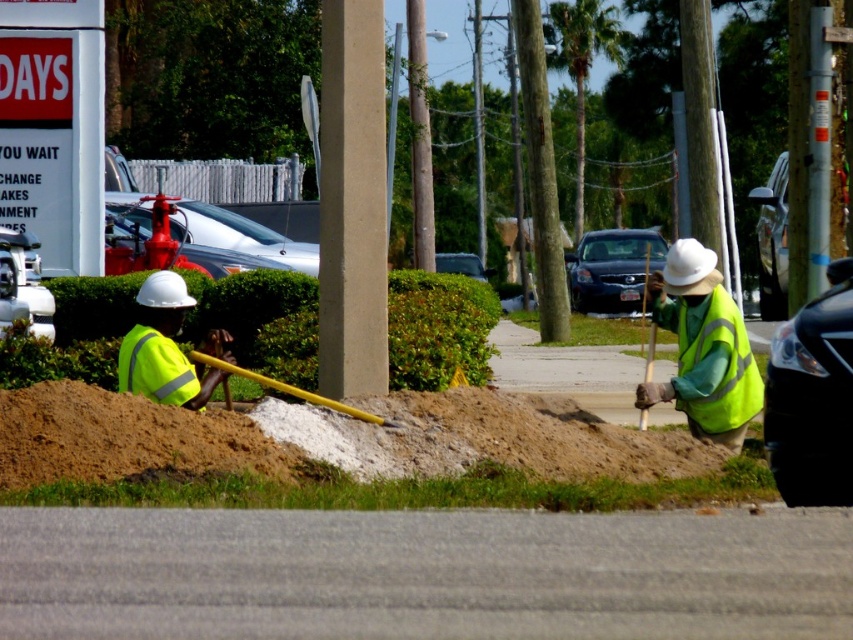
Between brown sandy dirt at center and green reflective safety vest at right, which one has more height?

Standing taller between the two is green reflective safety vest at right.

Where is `brown sandy dirt at center`? The height and width of the screenshot is (640, 853). brown sandy dirt at center is located at coordinates (483, 436).

Is high-visibility yellow safety vest at lower left smaller than yellow plastic shovel at lower center?

Correct, high-visibility yellow safety vest at lower left occupies less space than yellow plastic shovel at lower center.

Is high-visibility yellow safety vest at lower left thinner than yellow plastic shovel at lower center?

Yes, high-visibility yellow safety vest at lower left is thinner than yellow plastic shovel at lower center.

Where is `high-visibility yellow safety vest at lower left`? high-visibility yellow safety vest at lower left is located at coordinates (155, 368).

Does brown sandy dirt at lower left appear over high-visibility yellow vest at right?

No.

Based on the photo, does brown sandy dirt at lower left appear on the left side of high-visibility yellow vest at right?

Correct, you'll find brown sandy dirt at lower left to the left of high-visibility yellow vest at right.

In order to click on brown sandy dirt at lower left in this screenshot , I will do `click(125, 436)`.

Locate an element on the screen. This screenshot has height=640, width=853. brown sandy dirt at lower left is located at coordinates (125, 436).